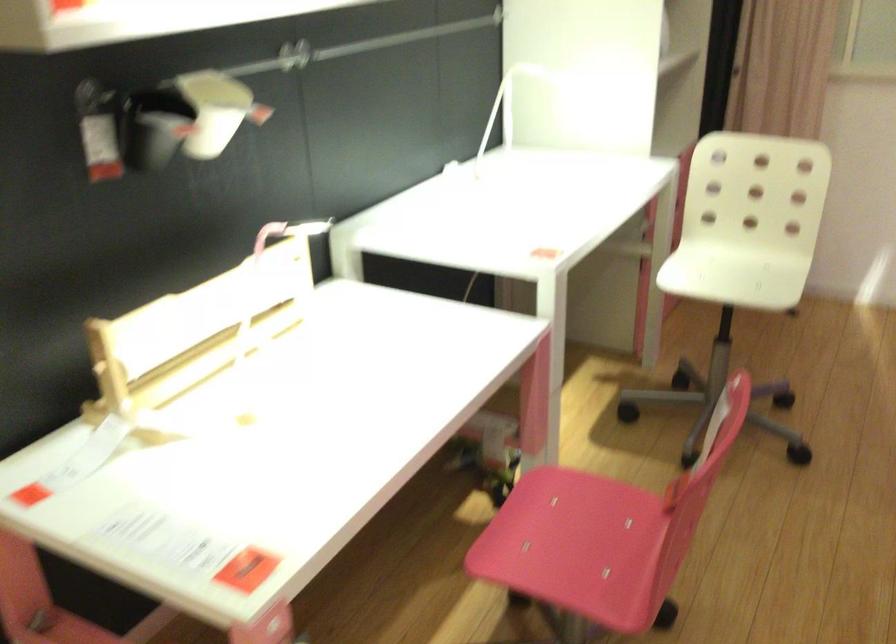
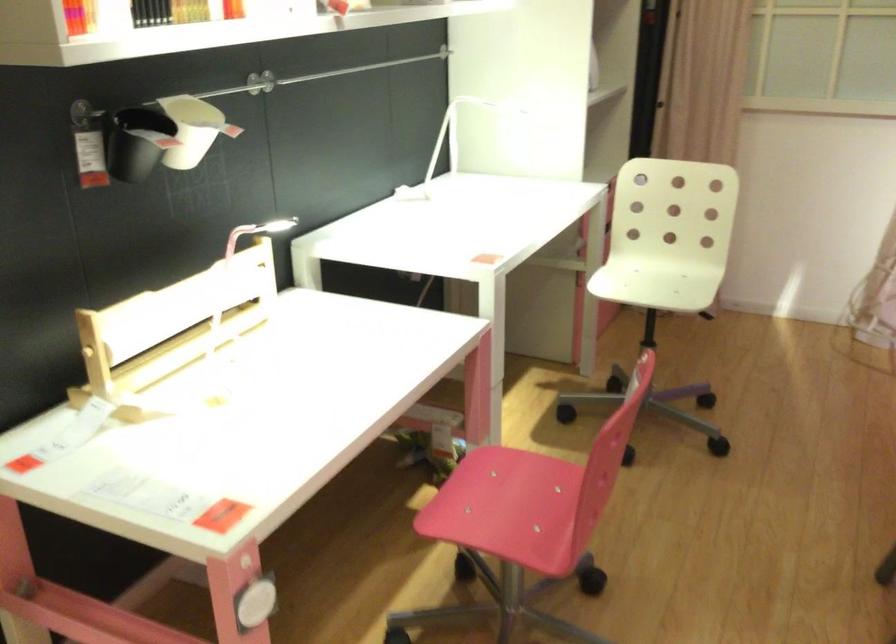
Where in the second image is the point corresponding to [214,113] from the first image?

(193, 129)